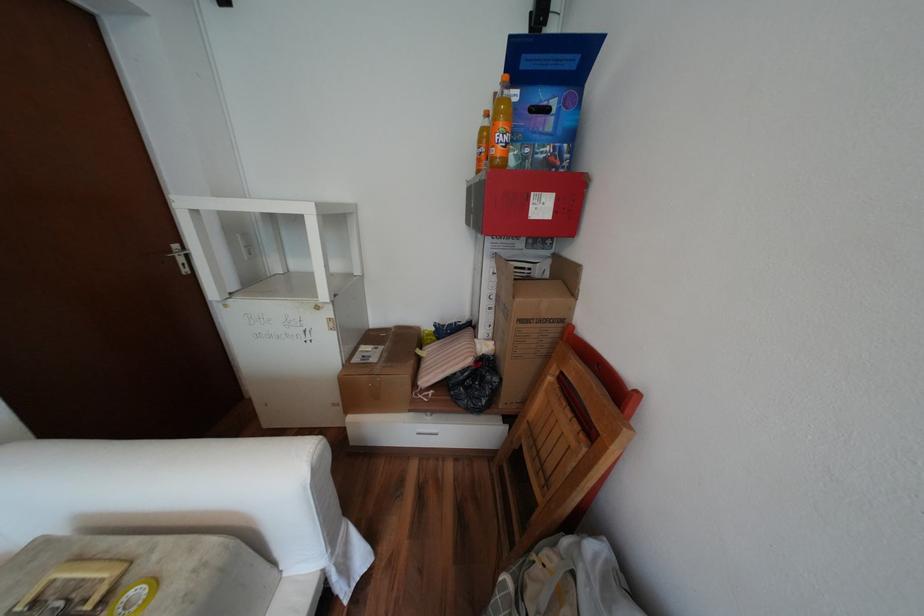
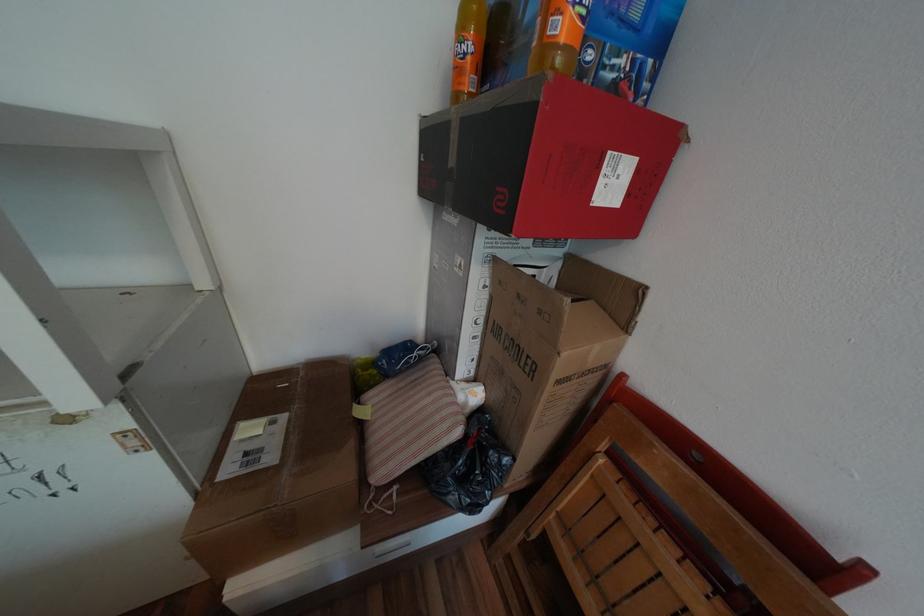
Question: The images are taken continuously from a first-person perspective. In which direction are you moving?

Choices:
 (A) Left
 (B) Right
 (C) Forward
 (D) Backward

Answer: (C)